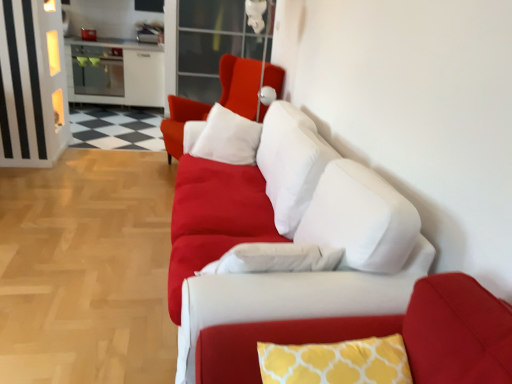
This screenshot has height=384, width=512. In order to click on free space in front of white glossy cabinet at upper left in this screenshot , I will do `click(109, 122)`.